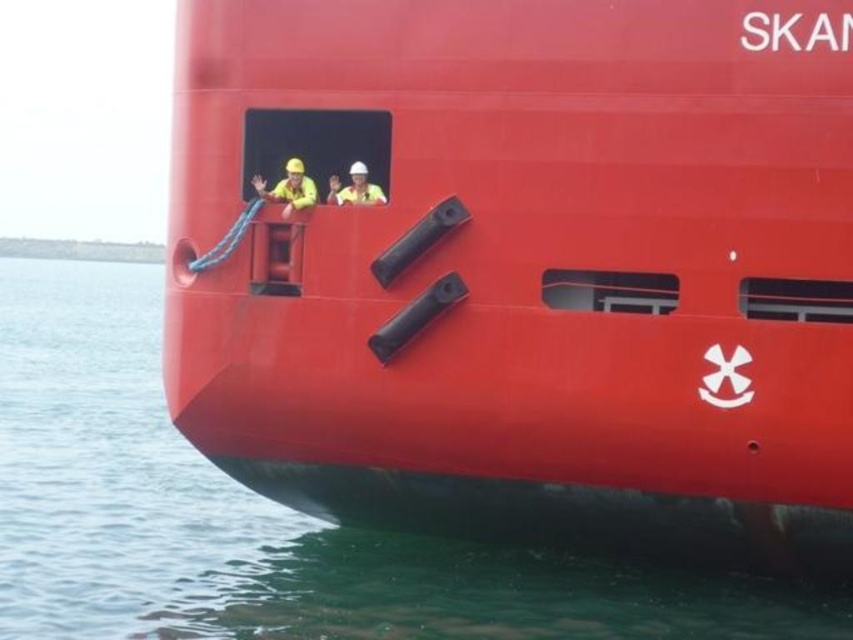
You are a dock worker who needs to secure the ship using a rope. The smooth red ship at center is narrower than the green water at lower left. Which object should you attach the rope to if you want to secure the ship effectively?

You should attach the rope to the smooth red ship at center because it has a lesser width compared to the green water at lower left, making it easier to secure the ship properly.

You are a sailor trying to dock the smooth red ship at center. You notice the green water at lower left. Which object takes up more space in the image?

The green water at lower left takes up more space in the image because the smooth red ship at center has a smaller size compared to green water at lower left.